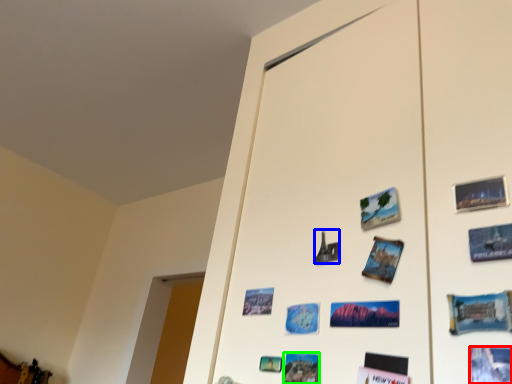
Question: Considering the real-world distances, which object is farthest from postcard (highlighted by a red box)? art (highlighted by a blue box) or postcard (highlighted by a green box)?

Choices:
 (A) art
 (B) postcard

Answer: (A)